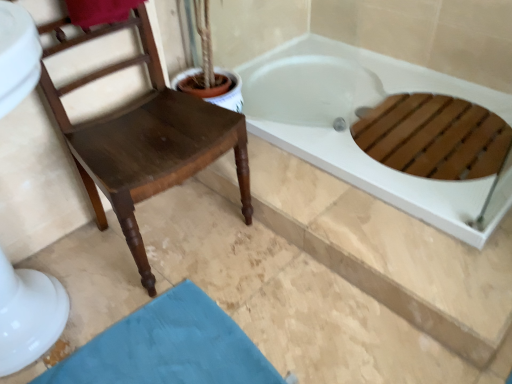
Question: From a real-world perspective, does teal fabric bath mat at lower left sit lower than dark brown wood chair at left?

Choices:
 (A) no
 (B) yes

Answer: (B)

Question: Can you confirm if teal fabric bath mat at lower left is positioned to the left of dark brown wood chair at left?

Choices:
 (A) no
 (B) yes

Answer: (A)

Question: Considering the relative sizes of teal fabric bath mat at lower left and dark brown wood chair at left in the image provided, is teal fabric bath mat at lower left smaller than dark brown wood chair at left?

Choices:
 (A) yes
 (B) no

Answer: (A)

Question: Is teal fabric bath mat at lower left aimed at dark brown wood chair at left?

Choices:
 (A) no
 (B) yes

Answer: (A)

Question: Is teal fabric bath mat at lower left wider than dark brown wood chair at left?

Choices:
 (A) yes
 (B) no

Answer: (A)

Question: Does teal fabric bath mat at lower left have a lesser height compared to dark brown wood chair at left?

Choices:
 (A) yes
 (B) no

Answer: (A)

Question: Is teal fabric bath mat at lower left taller than white glossy bathtub at upper right?

Choices:
 (A) no
 (B) yes

Answer: (A)

Question: Considering the relative positions of teal fabric bath mat at lower left and white glossy bathtub at upper right in the image provided, is teal fabric bath mat at lower left to the right of white glossy bathtub at upper right from the viewer's perspective?

Choices:
 (A) yes
 (B) no

Answer: (B)

Question: Is teal fabric bath mat at lower left next to white glossy bathtub at upper right and touching it?

Choices:
 (A) no
 (B) yes

Answer: (A)

Question: Could you tell me if teal fabric bath mat at lower left is turned towards white glossy bathtub at upper right?

Choices:
 (A) no
 (B) yes

Answer: (A)

Question: Can you confirm if teal fabric bath mat at lower left is smaller than white glossy bathtub at upper right?

Choices:
 (A) no
 (B) yes

Answer: (B)

Question: Is teal fabric bath mat at lower left not within white glossy bathtub at upper right?

Choices:
 (A) yes
 (B) no

Answer: (A)

Question: Is the depth of white glossy bathtub at upper right greater than that of dark brown wood chair at left?

Choices:
 (A) yes
 (B) no

Answer: (A)